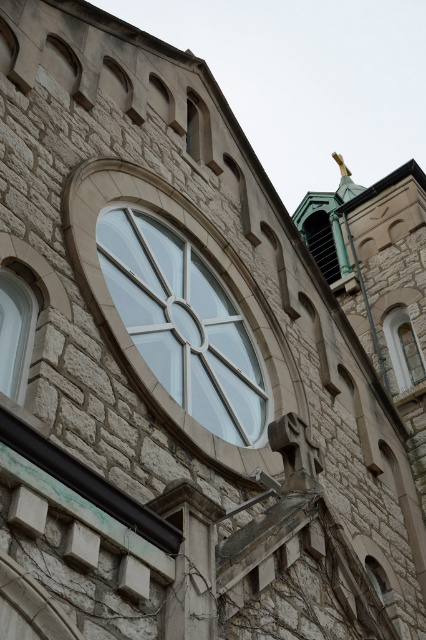
You are a window installer working on a historic building. You need to place a new window that is 4 meters wide between the clear glass window at left and the clear glass window at upper right. Can you fit it in the space between them?

The distance between the clear glass window at left and the clear glass window at upper right is 39.48 meters, which is significantly larger than the 4 meter width of the new window. Therefore, the new window can easily be placed in the space between them.